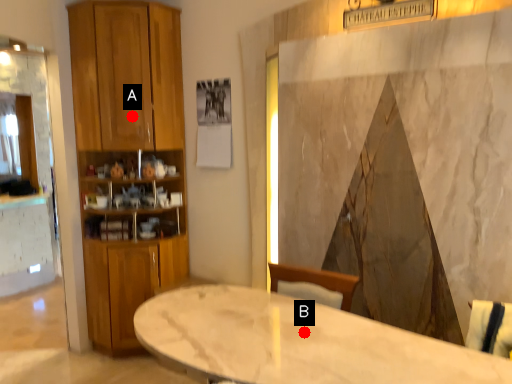
Question: Two points are circled on the image, labeled by A and B beside each circle. Which point appears closest to the camera in this image?

Choices:
 (A) A is closer
 (B) B is closer

Answer: (B)